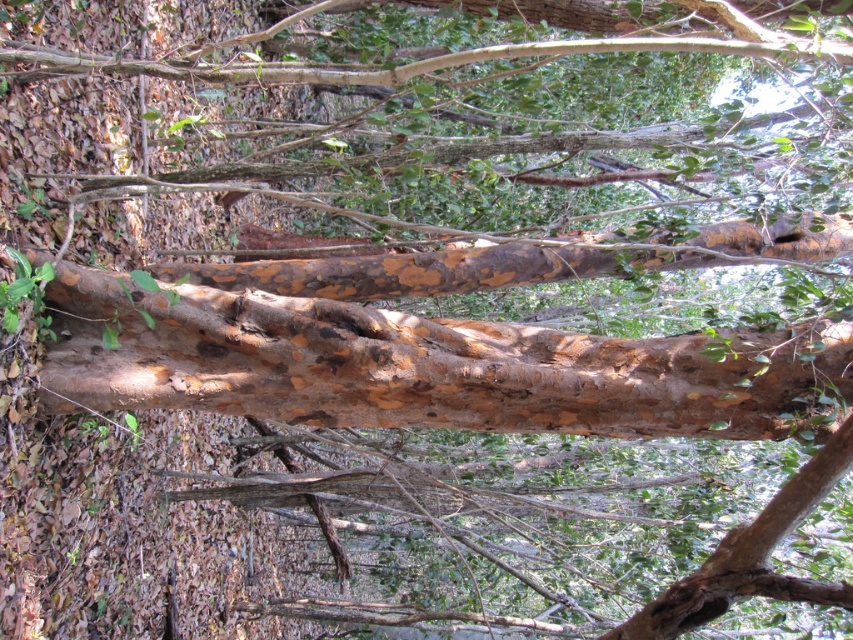
Does brown textured bark at center come in front of brown/corky bark branch at upper center?

No, brown textured bark at center is behind brown/corky bark branch at upper center.

The image size is (853, 640). Find the location of `brown textured bark at center`. brown textured bark at center is located at coordinates (427, 365).

Locate an element on the screen. brown textured bark at center is located at coordinates (427, 365).